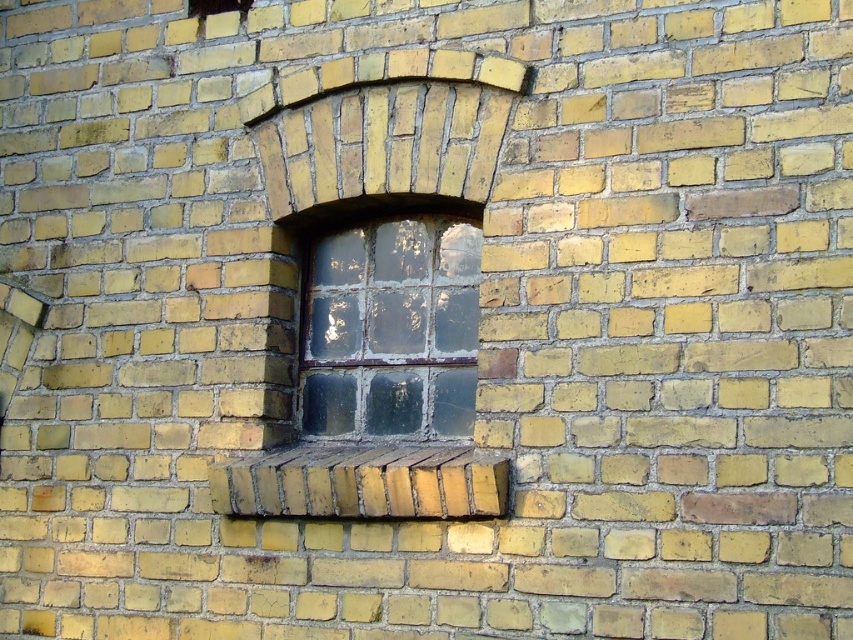
Who is higher up, clear glass window at center or yellow brick at center?

clear glass window at center

Identify the location of clear glass window at center. The width and height of the screenshot is (853, 640). (392, 330).

Between point (364, 413) and point (282, 451), which one is positioned behind?

The point (282, 451) is behind.

Image resolution: width=853 pixels, height=640 pixels. In order to click on clear glass window at center in this screenshot , I will do `click(392, 330)`.